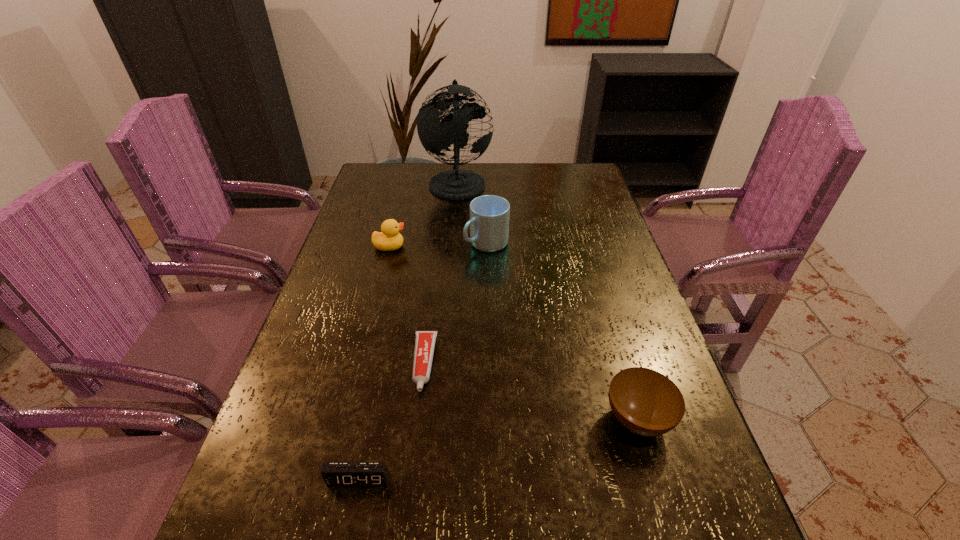
You are a GUI agent. You are given a task and a screenshot of the screen. Output one action in this format:
    pyautogui.click(x=<x>, y=<y>)
    Task: Click on the vacant space that satisfies the following two spatial constraints: 1. on the front-facing side of the farthest object; 2. on the front-facing side of the nearest object
    The height and width of the screenshot is (540, 960).
    Given the screenshot: What is the action you would take?
    pyautogui.click(x=435, y=479)

Image resolution: width=960 pixels, height=540 pixels. What are the coordinates of `free space that satisfies the following two spatial constraints: 1. at the beak of the third shortest object; 2. on the right side of the duck` in the screenshot? It's located at (346, 420).